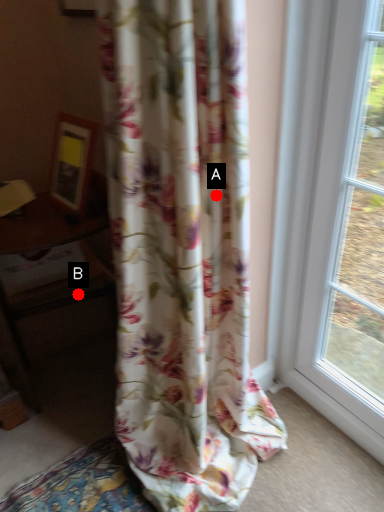
Question: Two points are circled on the image, labeled by A and B beside each circle. Which point appears closest to the camera in this image?

Choices:
 (A) A is closer
 (B) B is closer

Answer: (A)